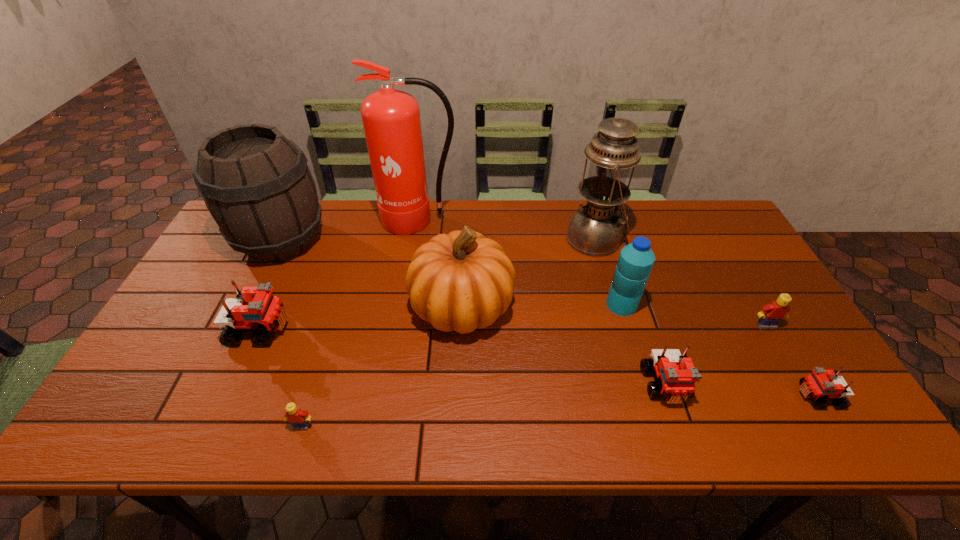
Find the location of a particular element. Image resolution: width=960 pixels, height=540 pixels. the second biggest red Lego is located at coordinates (677, 374).

Locate an element on the screen. This screenshot has width=960, height=540. the third Lego from right to left is located at coordinates (677, 374).

This screenshot has width=960, height=540. In order to click on the eighth object from right to left in this screenshot , I will do `click(300, 419)`.

You are a GUI agent. You are given a task and a screenshot of the screen. Output one action in this format:
    pyautogui.click(x=<x>, y=<y>)
    Task: Click on the left yellow Lego
    
    Given the screenshot: What is the action you would take?
    pyautogui.click(x=300, y=419)

Where is `the smallest red Lego`? This screenshot has height=540, width=960. the smallest red Lego is located at coordinates (822, 384).

Locate an element on the screen. vacant position located towards the nozzle of the tallest object is located at coordinates (407, 305).

Where is `free space located on the left of the oil lamp`? free space located on the left of the oil lamp is located at coordinates (445, 239).

The image size is (960, 540). Find the location of `free space located on the right of the wine bucket`. free space located on the right of the wine bucket is located at coordinates (402, 240).

This screenshot has height=540, width=960. I want to click on free space located 0.210m on the front of the pumpkin, so click(457, 425).

Find the location of a particular element. vacant area situated 0.180m on the right of the water bottle is located at coordinates (702, 305).